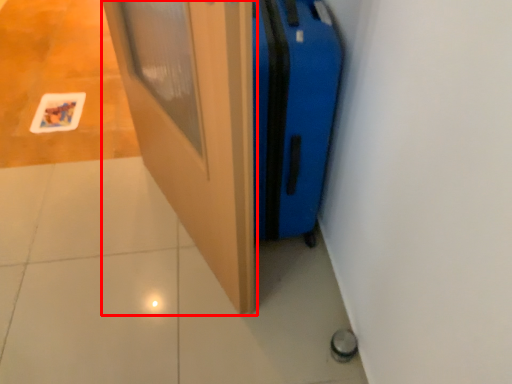
Question: From the image's perspective, what is the correct spatial relationship of door (annotated by the red box) in relation to luggage?

Choices:
 (A) below
 (B) above

Answer: (A)